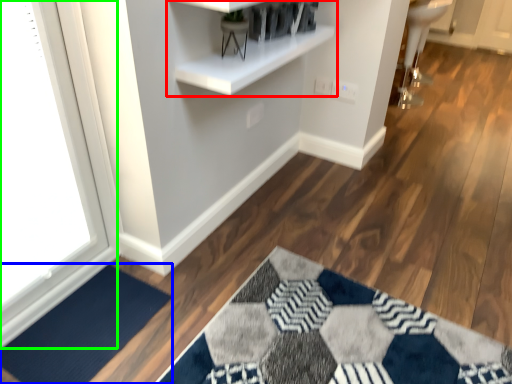
Question: Which is nearer to the shelf (highlighted by a red box)? doormat (highlighted by a blue box) or window (highlighted by a green box).

Choices:
 (A) doormat
 (B) window

Answer: (B)